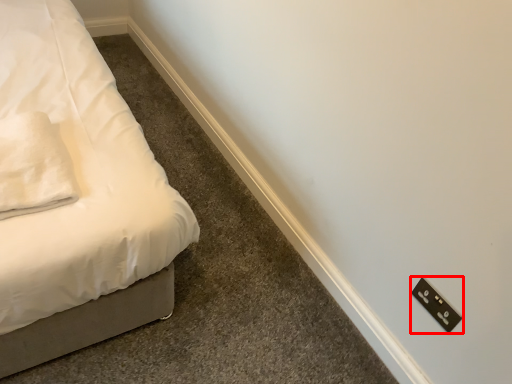
Question: Observing the image, what is the correct spatial positioning of light switch (annotated by the red box) in reference to pillow?

Choices:
 (A) right
 (B) left

Answer: (A)